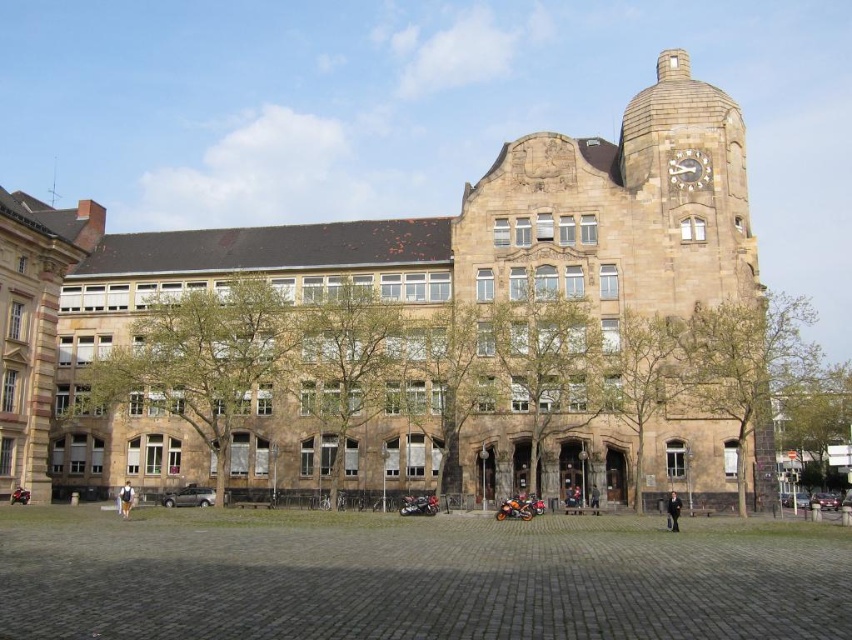
Question: Which of the following is the closest to the observer?

Choices:
 (A) brown leather jacket at lower left
 (B) silver metallic clock at upper center
 (C) brown stone clock tower at upper right
 (D) dark brown leather jacket at lower right

Answer: (D)

Question: Which point appears closest to the camera in this image?

Choices:
 (A) coord(122,500)
 (B) coord(695,294)

Answer: (A)

Question: Can you confirm if dark brown leather jacket at lower right is positioned above brown leather jacket at lower left?

Choices:
 (A) no
 (B) yes

Answer: (B)

Question: Which object appears closest to the camera in this image?

Choices:
 (A) dark brown leather jacket at lower right
 (B) silver metallic clock at upper center

Answer: (A)

Question: Does silver metallic clock at upper center appear over brown leather jacket at lower left?

Choices:
 (A) yes
 (B) no

Answer: (A)

Question: Is silver metallic clock at upper center positioned behind dark brown leather jacket at lower right?

Choices:
 (A) no
 (B) yes

Answer: (B)